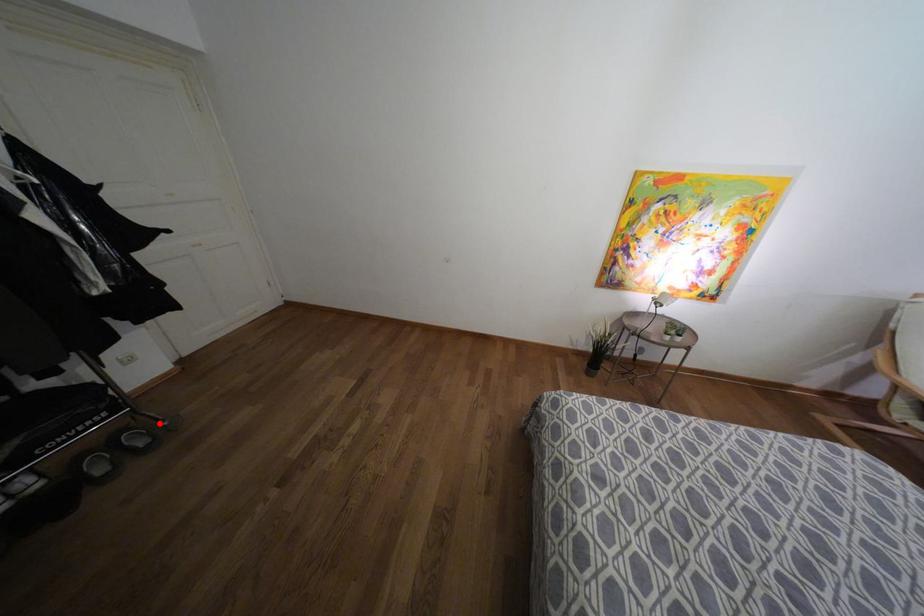
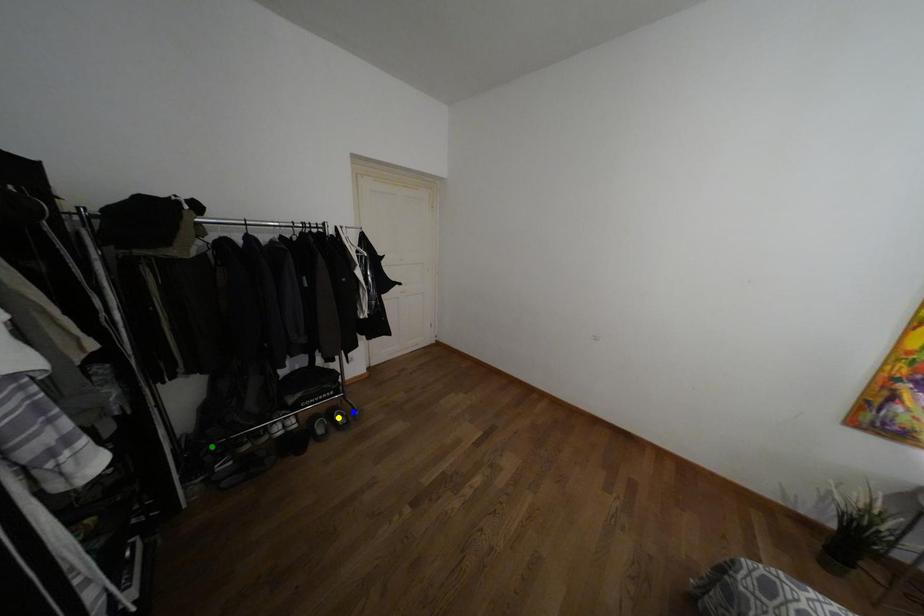
Question: I am providing you with two images of the same scene from different viewpoints. A red point is marked on the first image. You are given multiple points on the second image. In image 2, which mark is for the same physical point as the one in image 1?

Choices:
 (A) green point
 (B) blue point
 (C) yellow point

Answer: (B)